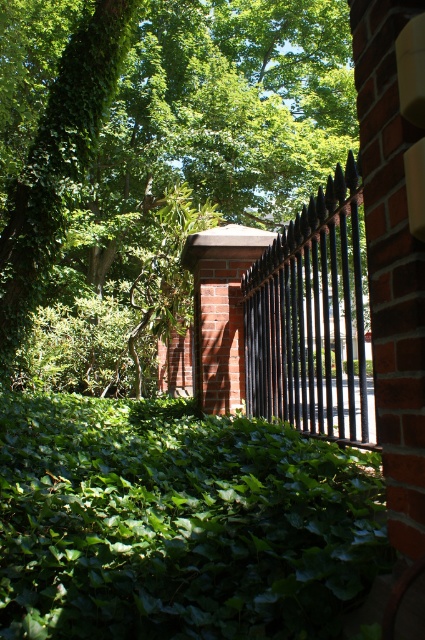
You are a gardener assessing the growth of plants in the scene. Which object, the green leafy ivy at center or the black metal fence at center, is taller?

The green leafy ivy at center is shorter than the black metal fence at center, so the black metal fence at center is taller.

You are standing in the garden looking at the green leafy ivy at center and the black metal fence at center. Which object is positioned to the left side from your viewpoint?

The green leafy ivy at center is positioned to the left of the black metal fence at center from your viewpoint.

You are standing in the garden and want to take a photo of the green leafy tree at upper left without the black metal fence at center blocking the view. Is the tree positioned in a way that allows this?

The green leafy tree at upper left is located above the black metal fence at center, so it is possible to take a photo of the green leafy tree at upper left without the black metal fence at center blocking the view by angling the camera upwards.